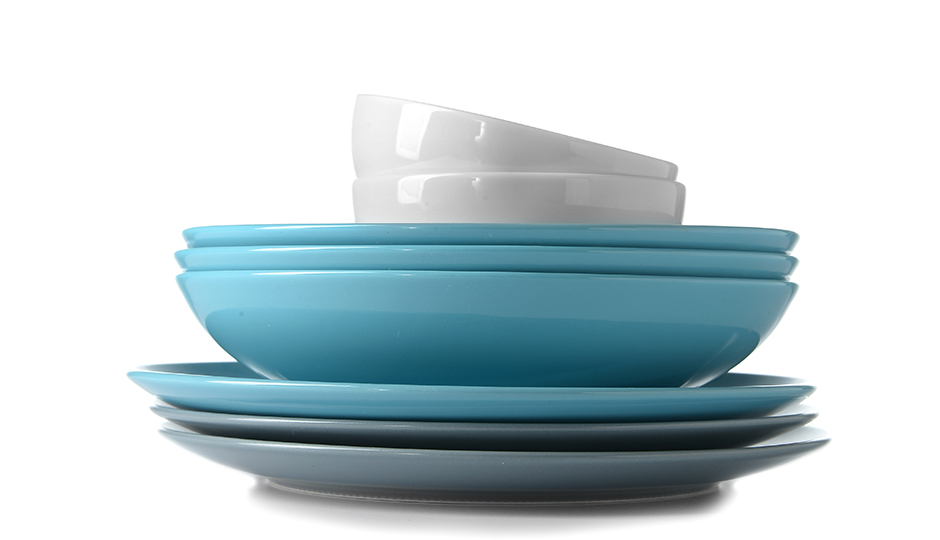
Where is `bowls`? bowls is located at coordinates (412, 127), (412, 187), (401, 231), (399, 248), (390, 280).